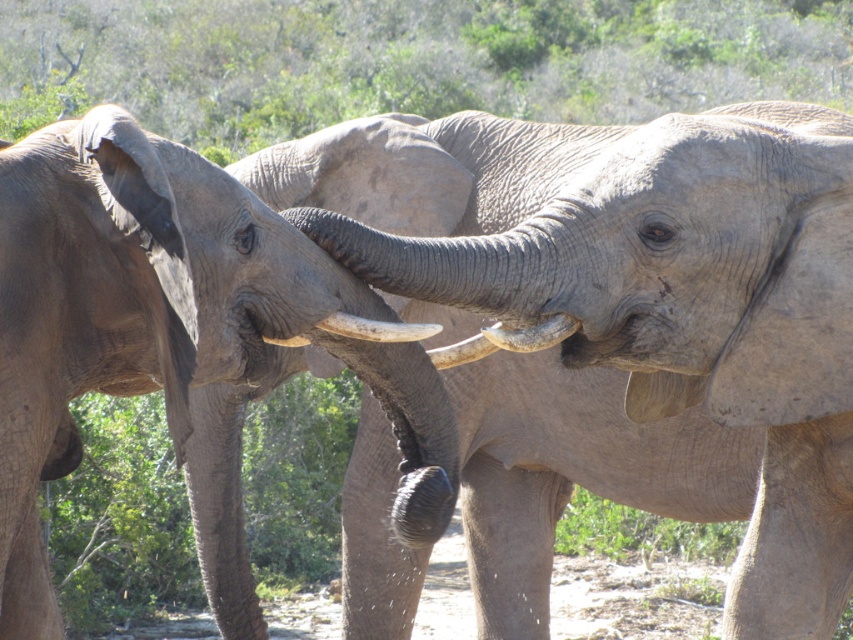
You are a wildlife photographer observing the elephants in the savanna. You want to take a photo of the gray textured elephant at left and the smooth ivory tusk at center. Based on their positions, which elephant is closer to the left edge of your camera frame?

The gray textured elephant at left is positioned on the left side of smooth ivory tusk at center, so it is closer to the left edge of the camera frame.

You are a wildlife photographer aiming to capture a closeup of the gray textured elephant at center and the gray matte tusk at center. Based on their positions, which one should you focus on first to ensure both are in frame?

The gray textured elephant at center is located below the gray matte tusk at center, so you should focus on the gray matte tusk at center first to ensure both are in frame.

You are a wildlife photographer planning to take a photo of the gray textured elephant at left and the smooth ivory tusk at center. Based on their sizes, which one should you focus on to ensure it fills the frame better?

The gray textured elephant at left should be focused on to ensure it fills the frame better since it is bigger than the smooth ivory tusk at center.